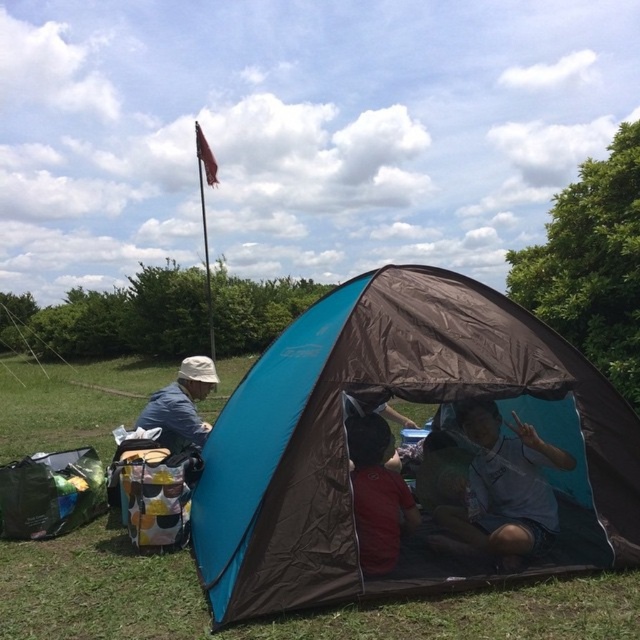
You are standing at the origin point in the image. Where is the matte blue tent at center located in terms of coordinates?

The matte blue tent at center is located at coordinates point (500, 490).

You are a hiker who needs to set up a 1.5 meter tall tent. You see the matte blue tent at center and the red matte shirt at center. Which object is taller than your tent?

The matte blue tent at center is taller than the red matte shirt at center. Since your tent is 1.5 meters tall, you can compare it to the existing tents. However, the description states the matte blue tent at center is taller than the red matte shirt at center, but there is no direct height comparison between the tent and the shirt. Therefore, it is unclear which object is taller than your 1.5 meter tent based on the given information.

You are planning to set up a tent in this camping scene. If you want to place your new tent to the right of the existing tents, where should you position it relative to the matte blue shirt at left and the matte blue tent at center?

The matte blue tent at center is already positioned to the right of the matte blue shirt at left. To place your new tent further to the right, position it to the right of the matte blue tent at center.